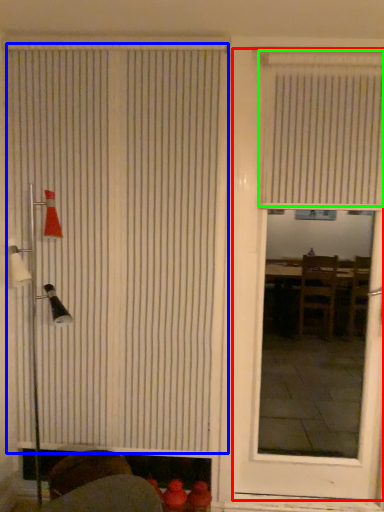
Question: Considering the real-world distances, which object is closest to door (highlighted by a red box)? window blind (highlighted by a blue box) or window blind (highlighted by a green box).

Choices:
 (A) window blind
 (B) window blind

Answer: (B)